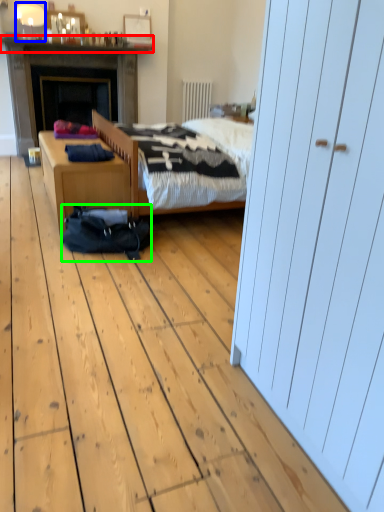
Question: Considering the real-world distances, which object is farthest from mantle (highlighted by a red box)? lamp (highlighted by a blue box) or sleeping bag (highlighted by a green box)?

Choices:
 (A) lamp
 (B) sleeping bag

Answer: (B)